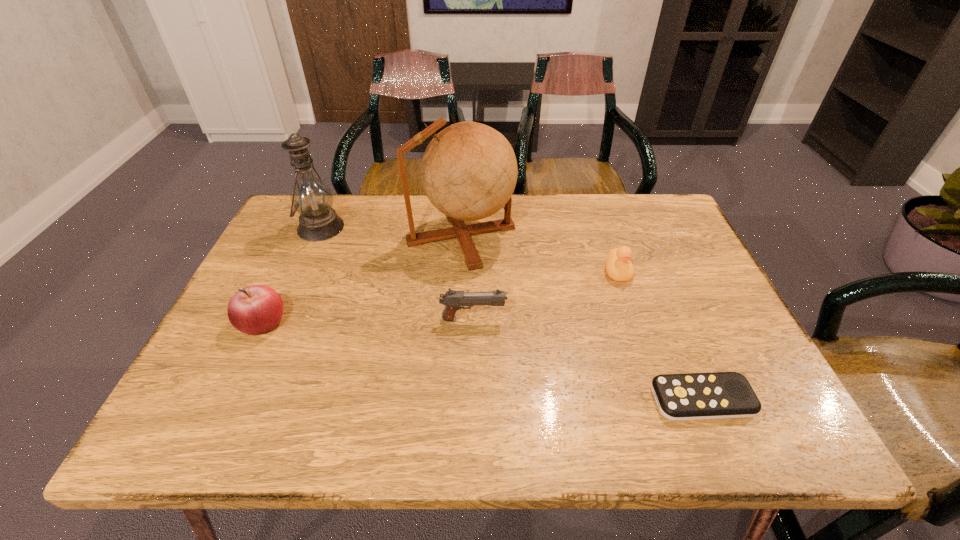
Where is `blank space located 0.230m in the direction the gun is aimed`? This screenshot has width=960, height=540. blank space located 0.230m in the direction the gun is aimed is located at coordinates (606, 319).

Image resolution: width=960 pixels, height=540 pixels. In order to click on vacant area situated on the face of the duck in this screenshot , I will do `click(635, 321)`.

The image size is (960, 540). What are the coordinates of `vacant area situated 0.390m on the left of the nearest object` in the screenshot? It's located at (454, 399).

You are a GUI agent. You are given a task and a screenshot of the screen. Output one action in this format:
    pyautogui.click(x=<x>, y=<y>)
    Task: Click on the globe situated at the far edge
    The width and height of the screenshot is (960, 540).
    Given the screenshot: What is the action you would take?
    pyautogui.click(x=469, y=171)

Where is `oil lamp situated at the far edge`? Image resolution: width=960 pixels, height=540 pixels. oil lamp situated at the far edge is located at coordinates (312, 198).

The image size is (960, 540). What are the coordinates of `object present at the near edge` in the screenshot? It's located at (716, 395).

Where is `oil lamp that is at the left edge`? oil lamp that is at the left edge is located at coordinates (312, 198).

The height and width of the screenshot is (540, 960). I want to click on apple that is at the left edge, so click(x=253, y=310).

Image resolution: width=960 pixels, height=540 pixels. What are the coordinates of `object that is at the right edge` in the screenshot? It's located at (716, 395).

The height and width of the screenshot is (540, 960). In order to click on object that is positioned at the far left corner in this screenshot , I will do `click(312, 198)`.